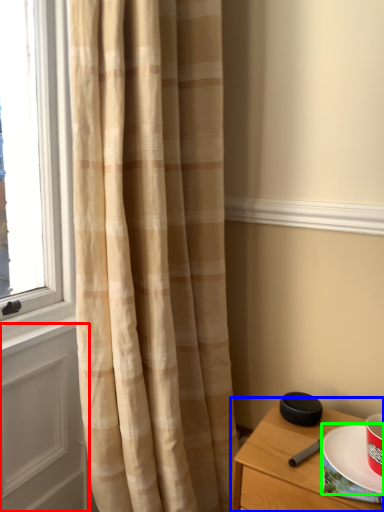
Question: Based on their relative distances, which object is nearer to screen door (highlighted by a red box)? Choose from nightstand (highlighted by a blue box) and paper plate (highlighted by a green box).

Choices:
 (A) nightstand
 (B) paper plate

Answer: (A)